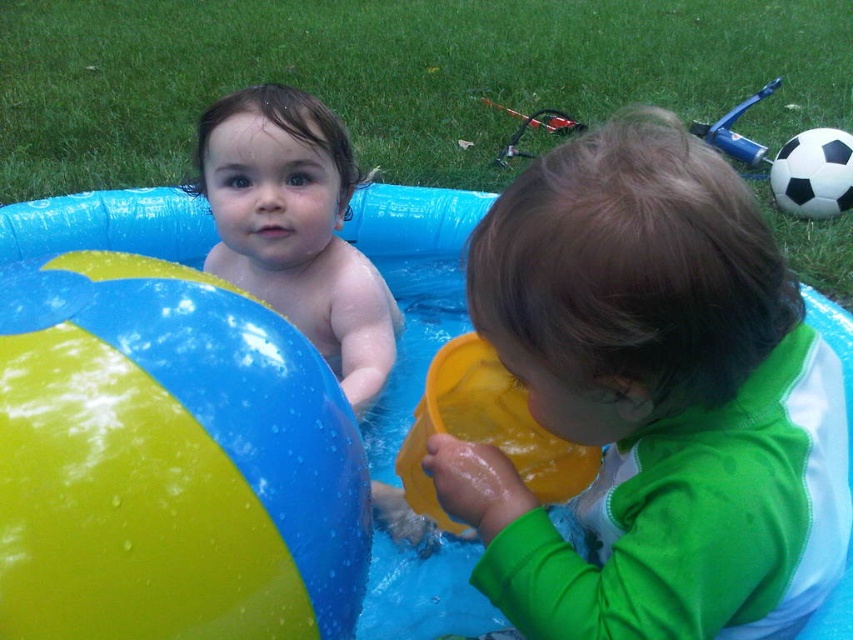
Question: Is yellowmattebeach ball at left behind black matte soccer ball at upper right?

Choices:
 (A) yes
 (B) no

Answer: (B)

Question: Does yellowmattebeach ball at left come behind smooth skin baby at center?

Choices:
 (A) yes
 (B) no

Answer: (B)

Question: Is yellowmattebeach ball at left bigger than black matte soccer ball at upper right?

Choices:
 (A) yes
 (B) no

Answer: (A)

Question: Which point is farther to the camera?

Choices:
 (A) (120, 476)
 (B) (155, 216)

Answer: (B)

Question: Which of the following is the closest to the observer?

Choices:
 (A) yellow plastic bucket at lower center
 (B) green rubberized toddler at center
 (C) yellowmattebeach ball at left

Answer: (B)

Question: Which point is farther from the camera taking this photo?

Choices:
 (A) (848, 198)
 (B) (318, 262)
 (C) (578, 490)

Answer: (A)